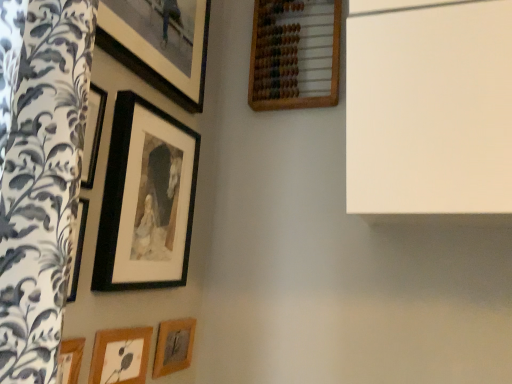
Question: Does matte black picture frame at upper left, which is counted as the 3th picture frame, starting from the right, have a greater width compared to wooden picture frame at lower left, the first picture frame viewed from the left?

Choices:
 (A) yes
 (B) no

Answer: (A)

Question: Considering the relative sizes of matte black picture frame at upper left, the 3th picture frame positioned from the left, and wooden picture frame at lower left, the first picture frame viewed from the left, in the image provided, is matte black picture frame at upper left, the 3th picture frame positioned from the left, taller than wooden picture frame at lower left, the first picture frame viewed from the left,?

Choices:
 (A) yes
 (B) no

Answer: (A)

Question: Does matte black picture frame at upper left, the 3th picture frame positioned from the left, have a larger size compared to wooden picture frame at lower left, the first picture frame viewed from the left?

Choices:
 (A) no
 (B) yes

Answer: (B)

Question: Can you confirm if matte black picture frame at upper left, which is counted as the 3th picture frame, starting from the right, is thinner than wooden picture frame at lower left, the first picture frame viewed from the left?

Choices:
 (A) no
 (B) yes

Answer: (A)

Question: Is matte black picture frame at upper left, the 3th picture frame positioned from the left, facing towards wooden picture frame at lower left, placed as the fifth picture frame when sorted from right to left?

Choices:
 (A) yes
 (B) no

Answer: (B)

Question: From the image's perspective, is matte black picture frame at upper left, the 3th picture frame positioned from the left, over wooden picture frame at lower left, the first picture frame viewed from the left?

Choices:
 (A) yes
 (B) no

Answer: (A)

Question: Can you confirm if wooden abacus at upper center, placed as the 5th picture frame when sorted from left to right, is bigger than matte black picture frame at upper left, which is counted as the 3th picture frame, starting from the right?

Choices:
 (A) no
 (B) yes

Answer: (B)

Question: Is wooden abacus at upper center, the 1th picture frame viewed from the right, further to the viewer compared to matte black picture frame at upper left, the 3th picture frame positioned from the left?

Choices:
 (A) yes
 (B) no

Answer: (A)

Question: Is wooden abacus at upper center, placed as the 5th picture frame when sorted from left to right, positioned with its back to matte black picture frame at upper left, which is counted as the 3th picture frame, starting from the right?

Choices:
 (A) yes
 (B) no

Answer: (B)

Question: Can you confirm if wooden abacus at upper center, placed as the 5th picture frame when sorted from left to right, is positioned to the right of matte black picture frame at upper left, the 3th picture frame positioned from the left?

Choices:
 (A) yes
 (B) no

Answer: (A)

Question: Are wooden abacus at upper center, placed as the 5th picture frame when sorted from left to right, and matte black picture frame at upper left, the 3th picture frame positioned from the left, far apart?

Choices:
 (A) yes
 (B) no

Answer: (B)

Question: From a real-world perspective, is wooden abacus at upper center, the 1th picture frame viewed from the right, on top of matte black picture frame at upper left, the 3th picture frame positioned from the left?

Choices:
 (A) yes
 (B) no

Answer: (A)

Question: Is wooden picture frame at lower center, acting as the second picture frame starting from the right, not close to black matte picture frame at upper left, the fourth picture frame from the right?

Choices:
 (A) no
 (B) yes

Answer: (A)